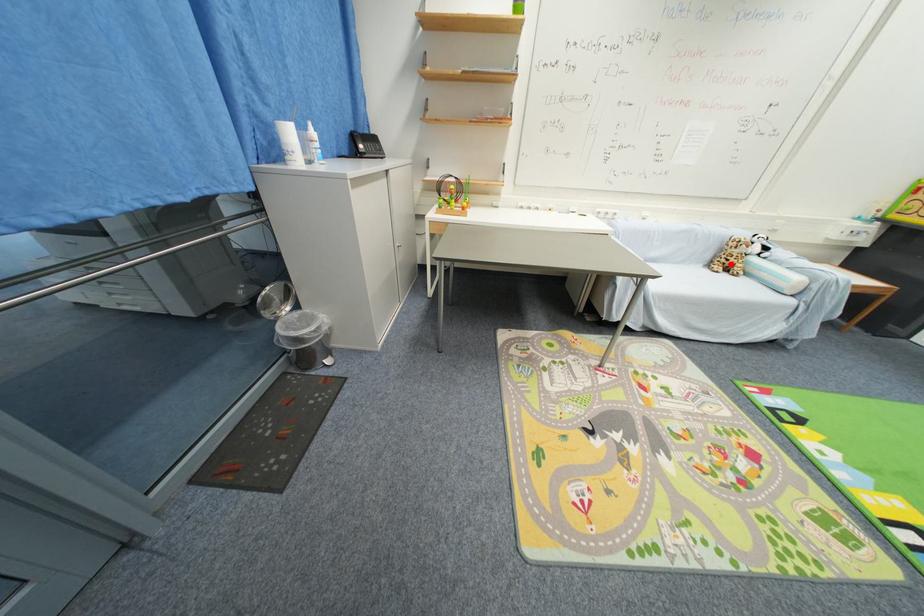
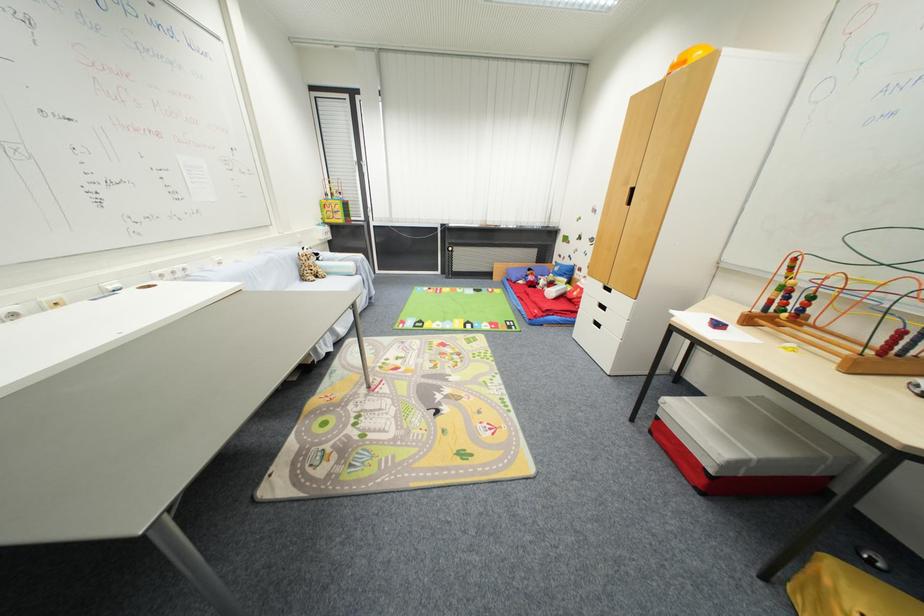
Find the pixel in the second image that matches the highlighted location in the first image.

(313, 274)